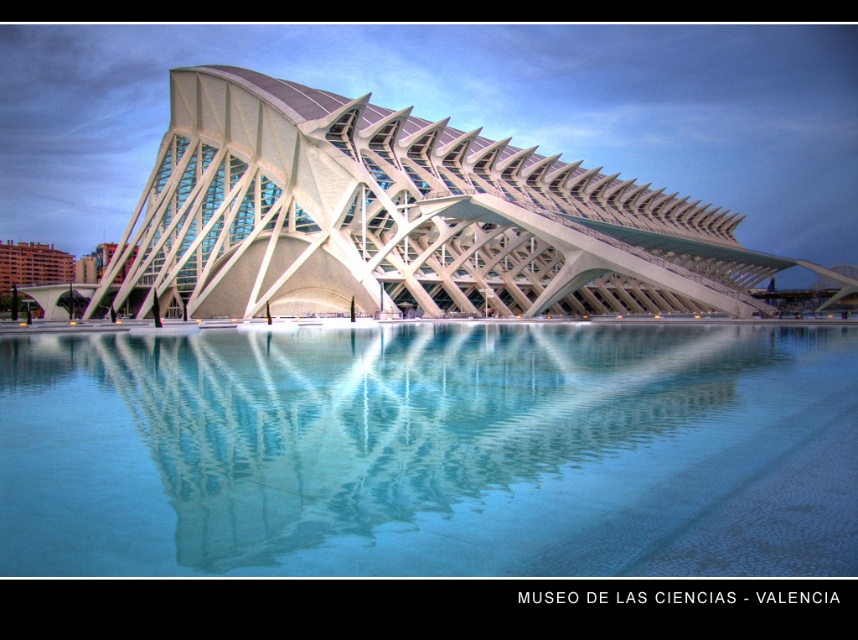
You are an architect visiting the Museo de las Ciencias in Valencia. You notice the clear glass water at center and the white glass building at center. Which one has a smaller width according to the description?

The clear glass water at center has a smaller width than the white glass building at center.

You are standing in front of the Museo de las Ciencias in Valencia, Spain. You notice a point at coordinates (431, 451). Based on the scene description, what object or feature is located at that point?

The point at coordinates (431, 451) corresponds to clear glass water at center.

You are standing in front of the Museo de las Ciencias in Valencia, Spain. You see the clear glass water at center. Can you determine its exact location based on the coordinates provided?

The clear glass water at center is located at point coordinates of (431,451).